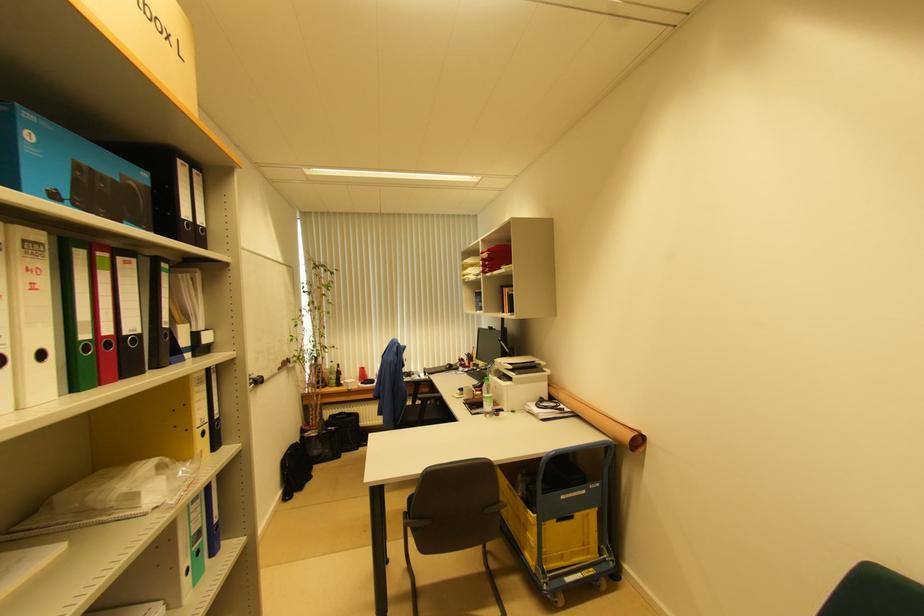
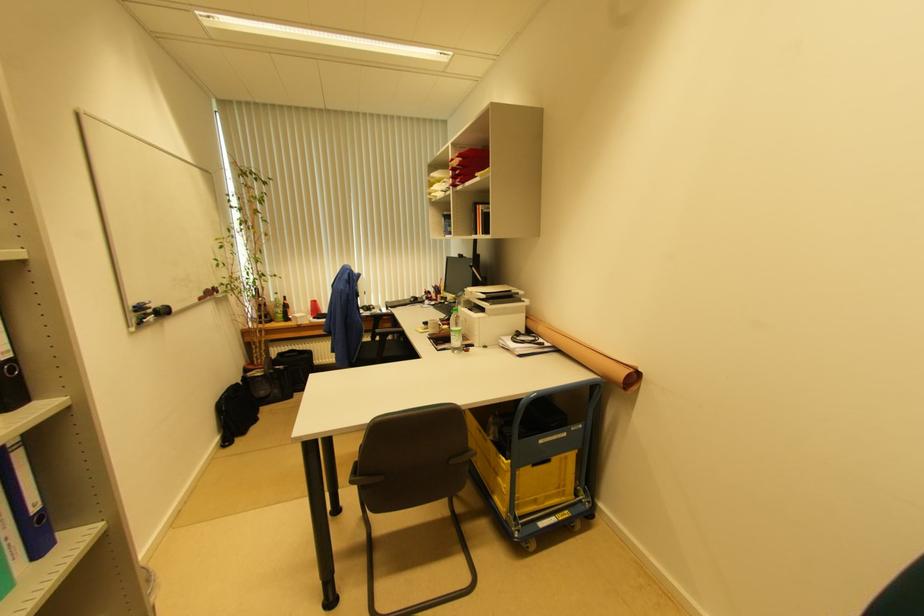
Find the pixel in the second image that matches point 551,387 in the first image.

(528, 320)